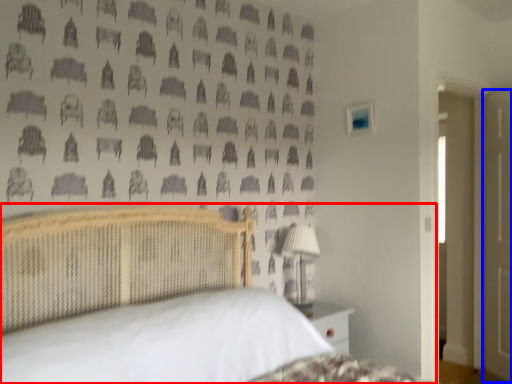
Question: Which point is further to the camera, bed (highlighted by a red box) or door (highlighted by a blue box)?

Choices:
 (A) bed
 (B) door

Answer: (B)